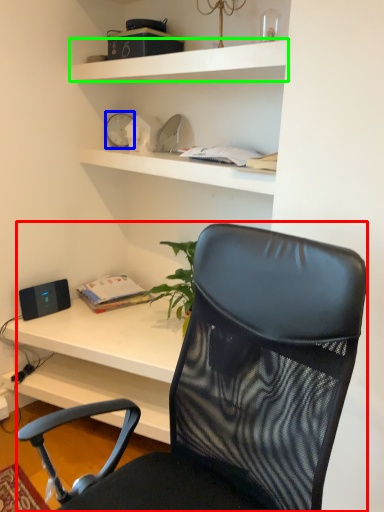
Question: Which object is positioned closest to chair (highlighted by a red box)? Select from clock (highlighted by a blue box) and shelf (highlighted by a green box).

Choices:
 (A) clock
 (B) shelf

Answer: (B)